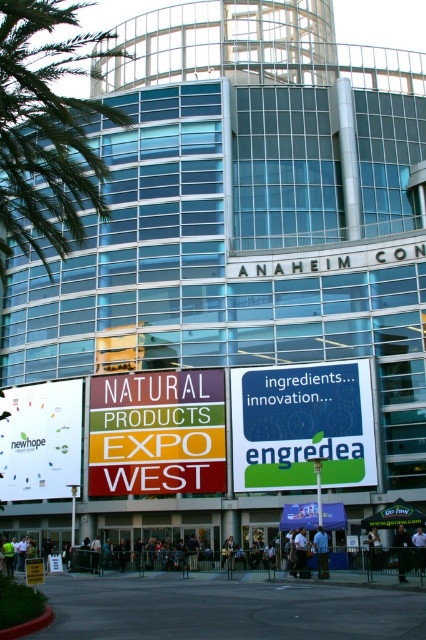
Can you confirm if blue-green plastic signboard at center is positioned to the right of denim jacket at lower center?

Yes, blue-green plastic signboard at center is to the right of denim jacket at lower center.

Who is shorter, blue-green plastic signboard at center or denim jacket at lower center?

denim jacket at lower center is shorter.

At what (x,y) coordinates should I click in order to perform the action: click on blue-green plastic signboard at center. Please return your answer as a coordinate pair (x, y). Looking at the image, I should click on (302, 426).

Between multicolored signboard at center and dark blue shirt at center, which one has less height?

With less height is dark blue shirt at center.

Who is higher up, multicolored signboard at center or dark blue shirt at center?

Positioned higher is multicolored signboard at center.

Who is more distant from viewer, (178, 435) or (425, 557)?

The point (178, 435) is behind.

Locate an element on the screen. The height and width of the screenshot is (640, 426). multicolored signboard at center is located at coordinates (157, 433).

Is green leafy palm tree at upper left taller than dark blue shirt at lower center?

Indeed, green leafy palm tree at upper left has a greater height compared to dark blue shirt at lower center.

Which is above, green leafy palm tree at upper left or dark blue shirt at lower center?

Positioned higher is green leafy palm tree at upper left.

Which is behind, point (123, 120) or point (155, 554)?

Positioned behind is point (155, 554).

Identify the location of green leafy palm tree at upper left. The width and height of the screenshot is (426, 640). (46, 131).